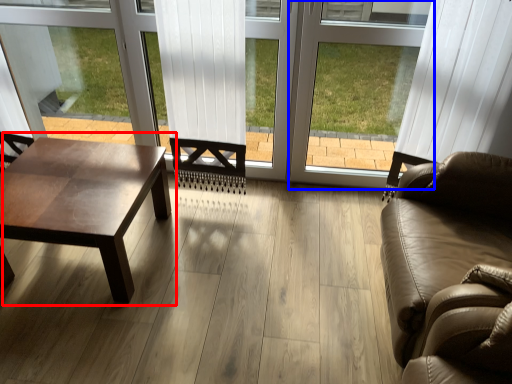
Question: Which object appears closest to the camera in this image, coffee table (highlighted by a red box) or window frame (highlighted by a blue box)?

Choices:
 (A) coffee table
 (B) window frame

Answer: (A)